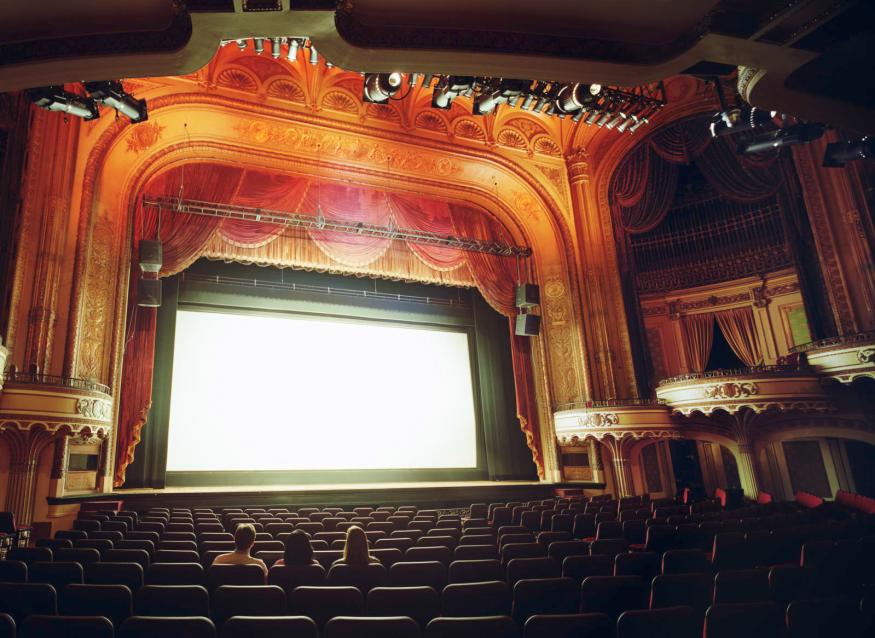
This screenshot has width=875, height=638. I want to click on stage, so click(418, 480).